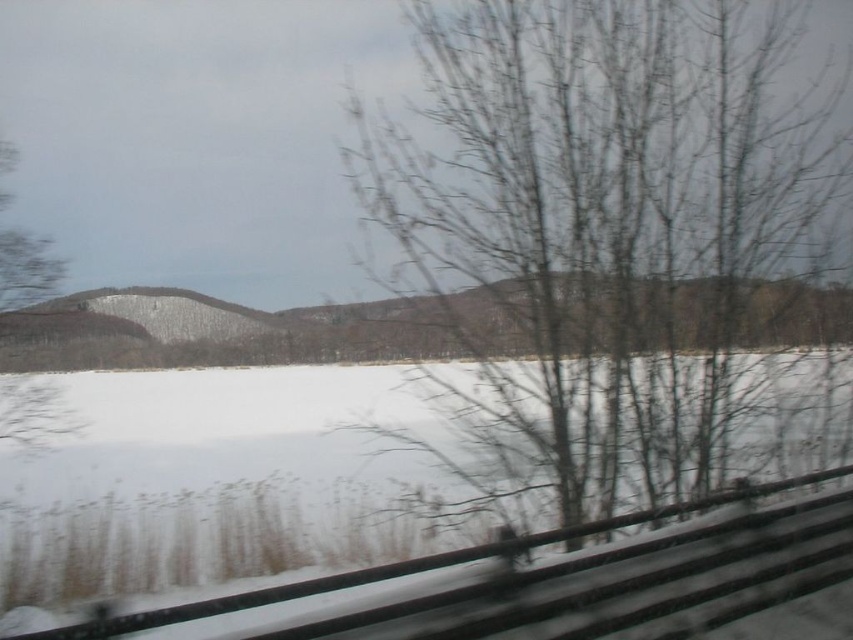
Question: Which of the following is the closest to the observer?

Choices:
 (A) (177, 513)
 (B) (21, 276)

Answer: (B)

Question: Which point is farther from the camera taking this photo?

Choices:
 (A) (793, 273)
 (B) (25, 259)
 (C) (799, 371)

Answer: (B)

Question: Is bare branches at center thinner than white matte snow at center?

Choices:
 (A) no
 (B) yes

Answer: (B)

Question: Can you confirm if bare branches at center is thinner than white matte snow at center?

Choices:
 (A) yes
 (B) no

Answer: (A)

Question: Estimate the real-world distances between objects in this image. Which object is closer to the bare branches at center?

Choices:
 (A) white matte snow at center
 (B) green matte tree at left

Answer: (A)

Question: Is bare branches at center further to camera compared to white matte snow at center?

Choices:
 (A) no
 (B) yes

Answer: (A)